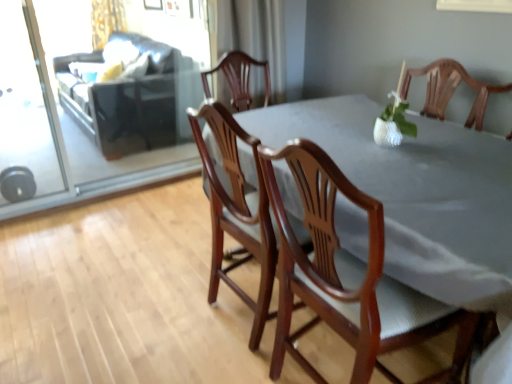
Question: Is wooden table at center completely or partially outside of wooden chair at center, acting as the first chair starting from the left?

Choices:
 (A) no
 (B) yes

Answer: (B)

Question: Is wooden table at center bigger than wooden chair at center, acting as the first chair starting from the left?

Choices:
 (A) no
 (B) yes

Answer: (B)

Question: Does wooden table at center have a lesser height compared to wooden chair at center, acting as the first chair starting from the left?

Choices:
 (A) no
 (B) yes

Answer: (B)

Question: Could you tell me if wooden table at center is turned towards wooden chair at center, which is the 2th chair in right-to-left order?

Choices:
 (A) no
 (B) yes

Answer: (B)

Question: Can you confirm if wooden table at center is positioned to the left of wooden chair at center, acting as the first chair starting from the left?

Choices:
 (A) yes
 (B) no

Answer: (B)

Question: Would you say wooden table at center is inside or outside white sheer curtain at upper center, which is the 1th curtain in right-to-left order?

Choices:
 (A) outside
 (B) inside

Answer: (A)

Question: Relative to white sheer curtain at upper center, which is the 2th curtain in back-to-front order, is wooden table at center in front or behind?

Choices:
 (A) front
 (B) behind

Answer: (A)

Question: From their relative heights in the image, would you say wooden table at center is taller or shorter than white sheer curtain at upper center, which is the 2th curtain in back-to-front order?

Choices:
 (A) short
 (B) tall

Answer: (B)

Question: From the image's perspective, is wooden table at center above or below white sheer curtain at upper center, which is the 2th curtain in back-to-front order?

Choices:
 (A) below
 (B) above

Answer: (A)

Question: Is wooden table at center in front of or behind wooden chair at center, which is the 2th chair in right-to-left order, in the image?

Choices:
 (A) behind
 (B) front

Answer: (B)

Question: Is point (438, 266) positioned closer to the camera than point (220, 112)?

Choices:
 (A) closer
 (B) farther

Answer: (A)

Question: Considering the positions of wooden table at center and wooden chair at center, which is the 2th chair in right-to-left order, in the image, is wooden table at center taller or shorter than wooden chair at center, which is the 2th chair in right-to-left order,?

Choices:
 (A) short
 (B) tall

Answer: (A)

Question: From the image's perspective, is wooden table at center located above or below wooden chair at center, acting as the first chair starting from the left?

Choices:
 (A) above
 (B) below

Answer: (B)

Question: Based on their sizes in the image, would you say dark brown leather couch at upper left is bigger or smaller than gold textured curtain at upper left, which is counted as the first curtain, starting from the left?

Choices:
 (A) big
 (B) small

Answer: (A)

Question: Considering the positions of dark brown leather couch at upper left and gold textured curtain at upper left, which is counted as the first curtain, starting from the left, in the image, is dark brown leather couch at upper left taller or shorter than gold textured curtain at upper left, which is counted as the first curtain, starting from the left,?

Choices:
 (A) tall
 (B) short

Answer: (A)